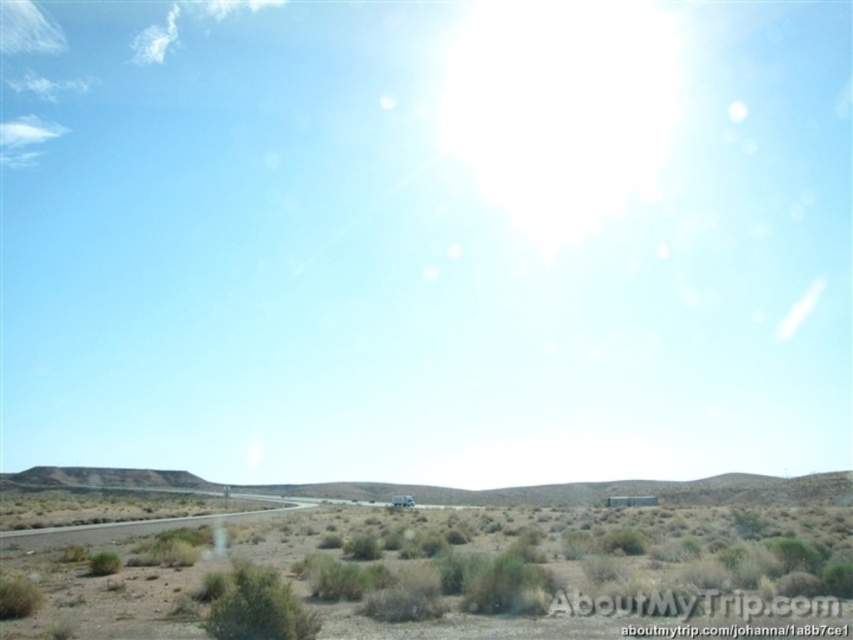
Can you confirm if brown dry grass at lower center is positioned below gray asphalt highway at lower left?

Correct, brown dry grass at lower center is located below gray asphalt highway at lower left.

Between brown dry grass at lower center and gray asphalt highway at lower left, which one has less height?

Standing shorter between the two is gray asphalt highway at lower left.

This screenshot has height=640, width=853. What do you see at coordinates (428, 557) in the screenshot?
I see `brown dry grass at lower center` at bounding box center [428, 557].

Identify the location of brown dry grass at lower center. (428, 557).

Does gray asphalt highway at lower left come in front of white matte truck at center?

Yes, gray asphalt highway at lower left is closer to the viewer.

Is point (7, 531) farther from viewer compared to point (404, 497)?

No, it is not.

Where is `gray asphalt highway at lower left`? The image size is (853, 640). gray asphalt highway at lower left is located at coordinates (120, 529).

Can you confirm if brown dry grass at lower center is smaller than white matte truck at center?

No.

Can you confirm if brown dry grass at lower center is shorter than white matte truck at center?

No.

Is point (486, 524) positioned in front of point (393, 497)?

Yes, point (486, 524) is closer to viewer.

At what (x,y) coordinates should I click in order to perform the action: click on brown dry grass at lower center. Please return your answer as a coordinate pair (x, y). Looking at the image, I should click on (428, 557).